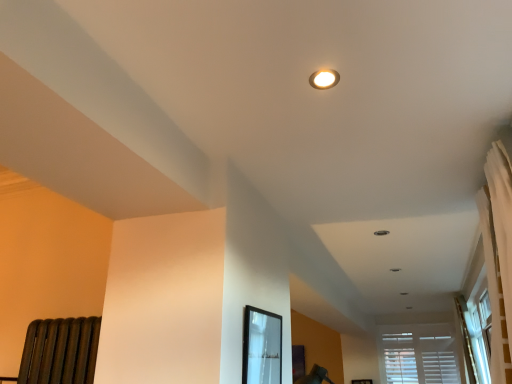
Question: Would you say white wood blinds at lower right is inside or outside matte black frame at center?

Choices:
 (A) inside
 (B) outside

Answer: (B)

Question: Is white wood blinds at lower right in front of or behind matte black frame at center in the image?

Choices:
 (A) front
 (B) behind

Answer: (B)

Question: Which object is the farthest from the white wood blinds at lower right?

Choices:
 (A) matte white light fixture at upper center
 (B) matte black frame at center

Answer: (A)

Question: Which is farther from the matte black frame at center?

Choices:
 (A) white wood blinds at lower right
 (B) matte white light fixture at upper center

Answer: (A)